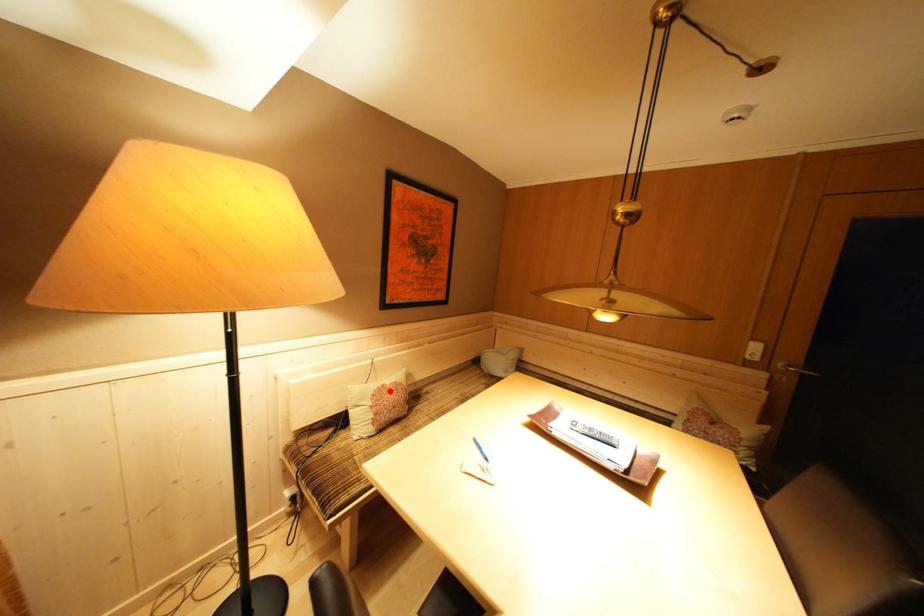
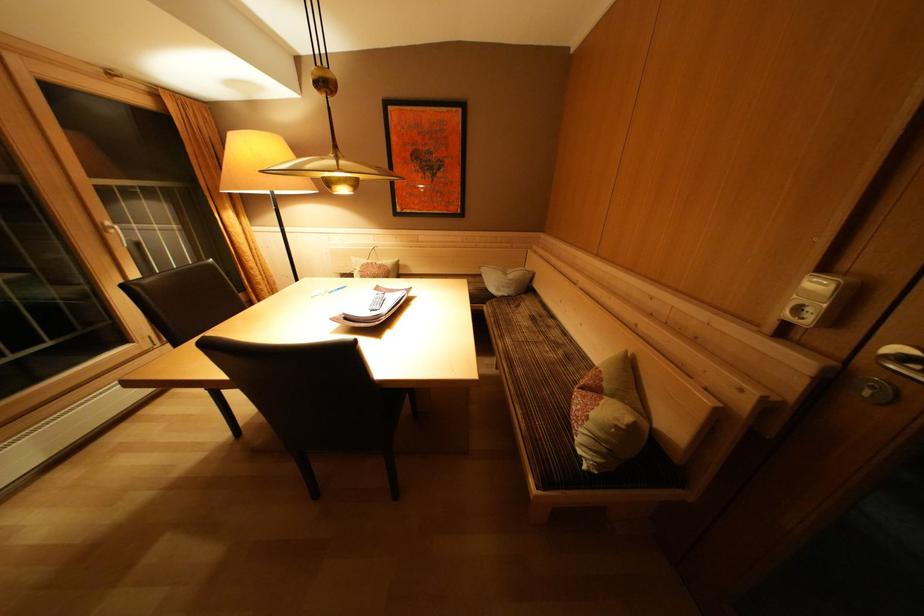
Question: A red point is marked in image1. In image2, is the corresponding 3D point closer to the camera or farther? Reply with the corresponding letter.

Choices:
 (A) The corresponding 3D point is closer.
 (B) The corresponding 3D point is farther.

Answer: (A)